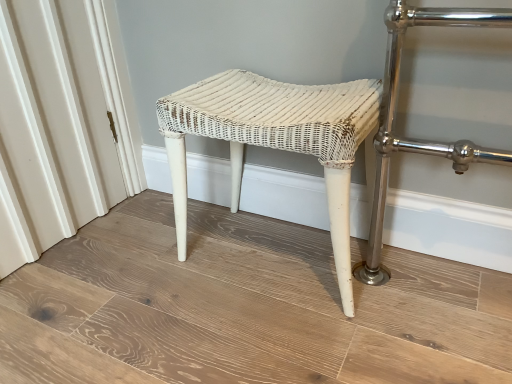
Where is `white wicker stool at center`? white wicker stool at center is located at coordinates (243, 308).

The height and width of the screenshot is (384, 512). What do you see at coordinates (243, 308) in the screenshot? I see `white wicker stool at center` at bounding box center [243, 308].

What is the approximate height of white wicker stool at center?

1.43 inches.

Describe the element at coordinates (274, 139) in the screenshot. I see `white wicker stool at center` at that location.

I want to click on white wicker stool at center, so click(274, 139).

At what (x,y) coordinates should I click in order to perform the action: click on white wicker stool at center. Please return your answer as a coordinate pair (x, y). Looking at the image, I should click on (243, 308).

Considering the positions of objects white wicker stool at center and white wicker stool at center in the image provided, who is more to the right, white wicker stool at center or white wicker stool at center?

white wicker stool at center is more to the right.

Does white wicker stool at center come behind white wicker stool at center?

That is True.

Considering the points (345, 164) and (137, 231), which point is behind, point (345, 164) or point (137, 231)?

Positioned behind is point (137, 231).

From the image's perspective, is white wicker stool at center located beneath white wicker stool at center?

Incorrect, from the image's perspective, white wicker stool at center is higher than white wicker stool at center.

From a real-world perspective, is white wicker stool at center on top of white wicker stool at center?

Yes, from a real-world perspective, white wicker stool at center is above white wicker stool at center.

Which object is wider, white wicker stool at center or white wicker stool at center?

white wicker stool at center is wider.

Between white wicker stool at center and white wicker stool at center, which one has less height?

white wicker stool at center.

Considering the relative sizes of white wicker stool at center and white wicker stool at center in the image provided, is white wicker stool at center bigger than white wicker stool at center?

Yes.

Is white wicker stool at center a part of white wicker stool at center?

No, white wicker stool at center is not surrounded by white wicker stool at center.

Is white wicker stool at center next to white wicker stool at center and touching it?

No, white wicker stool at center is not with white wicker stool at center.

Based on the photo, is white wicker stool at center oriented away from white wicker stool at center?

No, white wicker stool at center is not facing away from white wicker stool at center.

Where is `plank on the left of the white wicker stool at center`? The width and height of the screenshot is (512, 384). plank on the left of the white wicker stool at center is located at coordinates (243, 308).

Can you confirm if white wicker stool at center is positioned to the left of white wicker stool at center?

Indeed, white wicker stool at center is positioned on the left side of white wicker stool at center.

Which object is closer to the camera taking this photo, white wicker stool at center or white wicker stool at center?

white wicker stool at center is closer to the camera.

Does point (346, 382) appear closer or farther from the camera than point (335, 210)?

Point (346, 382) is closer to the camera than point (335, 210).

In the scene shown: From the image's perspective, is white wicker stool at center above white wicker stool at center?

No, from the image's perspective, white wicker stool at center is not over white wicker stool at center.

From a real-world perspective, relative to white wicker stool at center, is white wicker stool at center vertically above or below?

white wicker stool at center is situated lower than white wicker stool at center in the real world.

Considering the relative sizes of white wicker stool at center and white wicker stool at center in the image provided, is white wicker stool at center wider than white wicker stool at center?

Indeed, white wicker stool at center has a greater width compared to white wicker stool at center.

Considering the sizes of white wicker stool at center and white wicker stool at center in the image, is white wicker stool at center taller or shorter than white wicker stool at center?

Considering their sizes, white wicker stool at center has less height than white wicker stool at center.

Can you confirm if white wicker stool at center is bigger than white wicker stool at center?

Incorrect, white wicker stool at center is not larger than white wicker stool at center.

Would you say white wicker stool at center is part of white wicker stool at center's contents?

That's incorrect, white wicker stool at center is not inside white wicker stool at center.

Is white wicker stool at center far away from white wicker stool at center?

Actually, white wicker stool at center and white wicker stool at center are a little close together.

Is white wicker stool at center oriented towards white wicker stool at center?

Yes, white wicker stool at center is aimed at white wicker stool at center.

Measure the distance between white wicker stool at center and white wicker stool at center.

12.04 inches.

Image resolution: width=512 pixels, height=384 pixels. What are the coordinates of `stool that is behind the white wicker stool at center` in the screenshot? It's located at (274, 139).

The image size is (512, 384). Find the location of `stool above the white wicker stool at center (from the image's perspective)`. stool above the white wicker stool at center (from the image's perspective) is located at coordinates (274, 139).

This screenshot has height=384, width=512. I want to click on stool on the right of white wicker stool at center, so click(274, 139).